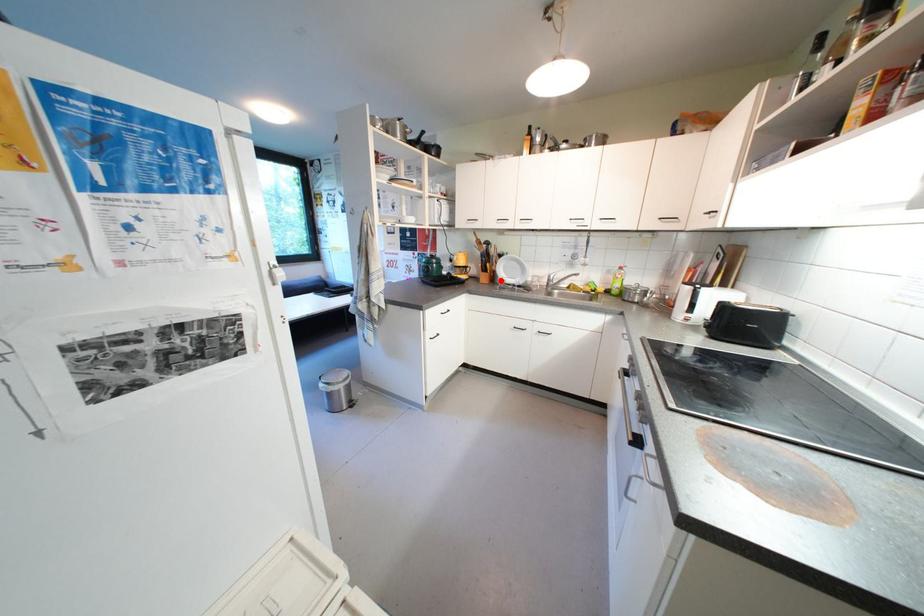
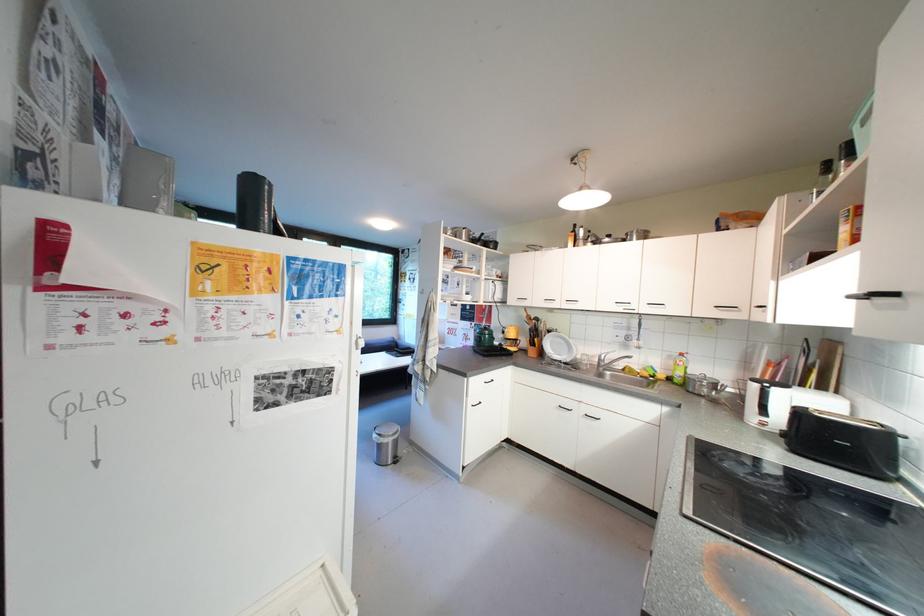
Find the pixel in the second image that matches the highlighted location in the first image.

(550, 355)